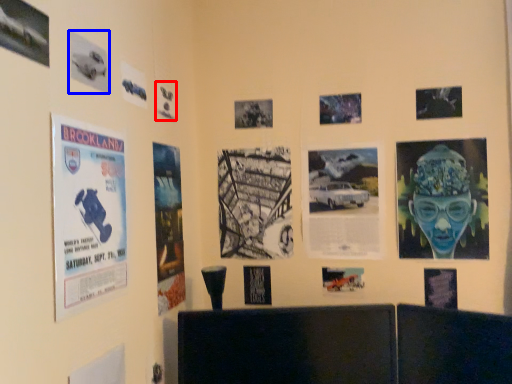
Question: Which object is further to the camera taking this photo, poster (highlighted by a red box) or poster (highlighted by a blue box)?

Choices:
 (A) poster
 (B) poster

Answer: (A)